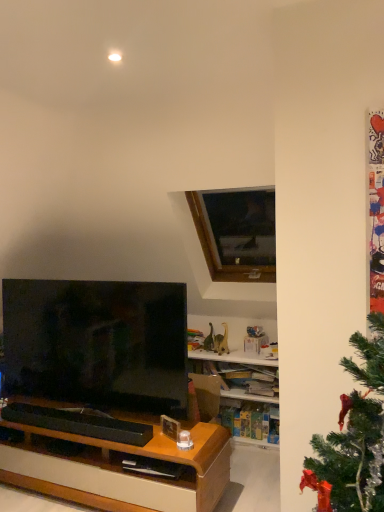
Question: Based on their sizes in the image, would you say matte black tv at left is bigger or smaller than wooden frame at upper center?

Choices:
 (A) big
 (B) small

Answer: (B)

Question: Does point (109, 397) appear closer or farther from the camera than point (266, 212)?

Choices:
 (A) closer
 (B) farther

Answer: (A)

Question: From the image's perspective, is matte black tv at left located above or below wooden frame at upper center?

Choices:
 (A) above
 (B) below

Answer: (B)

Question: Considering the relative positions of wooden frame at upper center and matte black tv at left in the image provided, is wooden frame at upper center to the left or to the right of matte black tv at left?

Choices:
 (A) right
 (B) left

Answer: (A)

Question: Is wooden frame at upper center inside or outside of matte black tv at left?

Choices:
 (A) inside
 (B) outside

Answer: (B)

Question: From a real-world perspective, is wooden frame at upper center above or below matte black tv at left?

Choices:
 (A) above
 (B) below

Answer: (A)

Question: Looking at their shapes, would you say wooden frame at upper center is wider or thinner than matte black tv at left?

Choices:
 (A) wide
 (B) thin

Answer: (A)